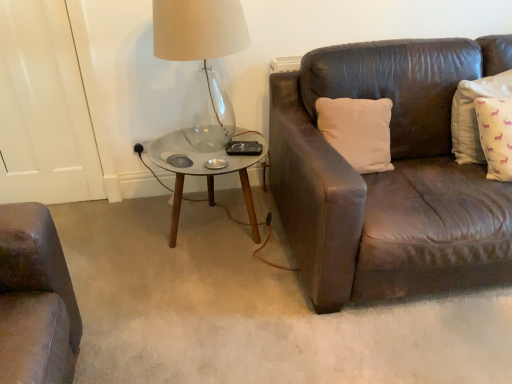
Question: From a real-world perspective, is yellow cotton pillow at right, placed as the 1th pillow when sorted from right to left, under metallic glass coffee table at center?

Choices:
 (A) yes
 (B) no

Answer: (B)

Question: Is yellow cotton pillow at right, which ranks as the second pillow in left-to-right order, aimed at metallic glass coffee table at center?

Choices:
 (A) no
 (B) yes

Answer: (A)

Question: Is yellow cotton pillow at right, which ranks as the second pillow in left-to-right order, bigger than metallic glass coffee table at center?

Choices:
 (A) yes
 (B) no

Answer: (B)

Question: Is yellow cotton pillow at right, placed as the 1th pillow when sorted from right to left, at the right side of metallic glass coffee table at center?

Choices:
 (A) yes
 (B) no

Answer: (A)

Question: Is yellow cotton pillow at right, placed as the 1th pillow when sorted from right to left, smaller than metallic glass coffee table at center?

Choices:
 (A) no
 (B) yes

Answer: (B)

Question: Can you confirm if yellow cotton pillow at right, which ranks as the second pillow in left-to-right order, is taller than metallic glass coffee table at center?

Choices:
 (A) yes
 (B) no

Answer: (A)

Question: Considering the relative positions of white matte pillow at upper right, which is the 2th pillow from right to left, and transparent glass table lamp at upper left in the image provided, is white matte pillow at upper right, which is the 2th pillow from right to left, to the right of transparent glass table lamp at upper left from the viewer's perspective?

Choices:
 (A) yes
 (B) no

Answer: (A)

Question: Can you confirm if white matte pillow at upper right, arranged as the 1th pillow when viewed from the left, is smaller than transparent glass table lamp at upper left?

Choices:
 (A) yes
 (B) no

Answer: (A)

Question: Considering the relative sizes of white matte pillow at upper right, arranged as the 1th pillow when viewed from the left, and transparent glass table lamp at upper left in the image provided, is white matte pillow at upper right, arranged as the 1th pillow when viewed from the left, taller than transparent glass table lamp at upper left?

Choices:
 (A) no
 (B) yes

Answer: (A)

Question: From the image's perspective, is white matte pillow at upper right, arranged as the 1th pillow when viewed from the left, under transparent glass table lamp at upper left?

Choices:
 (A) yes
 (B) no

Answer: (A)

Question: From the image's perspective, is white matte pillow at upper right, arranged as the 1th pillow when viewed from the left, located above transparent glass table lamp at upper left?

Choices:
 (A) no
 (B) yes

Answer: (A)

Question: Can we say white matte pillow at upper right, arranged as the 1th pillow when viewed from the left, lies outside transparent glass table lamp at upper left?

Choices:
 (A) yes
 (B) no

Answer: (A)

Question: Is the depth of yellow cotton pillow at right, which ranks as the second pillow in left-to-right order, less than that of transparent glass table lamp at upper left?

Choices:
 (A) yes
 (B) no

Answer: (B)